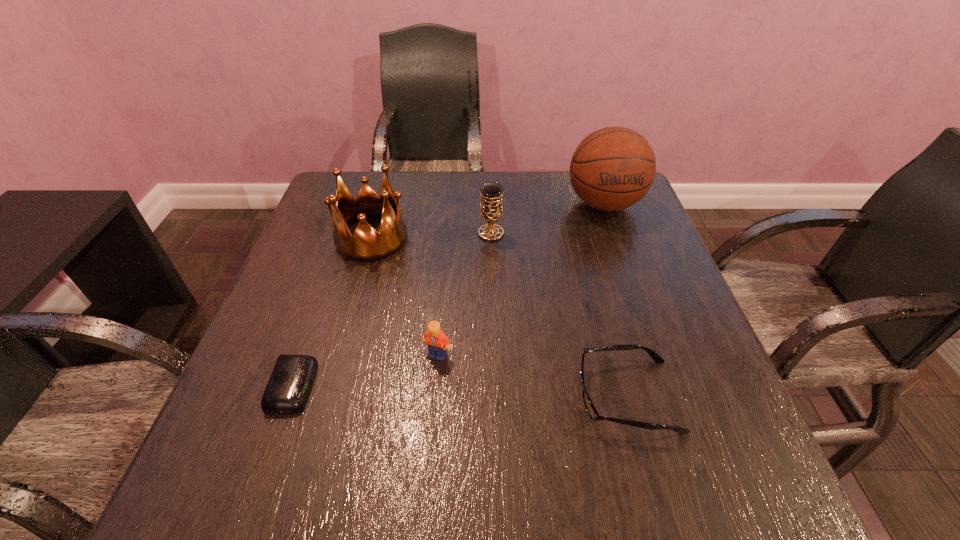
At what (x,y) coordinates should I click in order to perform the action: click on the tallest object. Please return your answer as a coordinate pair (x, y). The height and width of the screenshot is (540, 960). Looking at the image, I should click on (613, 168).

Find the location of `crown`. crown is located at coordinates (366, 245).

You are a GUI agent. You are given a task and a screenshot of the screen. Output one action in this format:
    pyautogui.click(x=<x>, y=<y>)
    Task: Click on the fourth shortest object
    Image resolution: width=960 pixels, height=540 pixels.
    Given the screenshot: What is the action you would take?
    pyautogui.click(x=491, y=211)

This screenshot has height=540, width=960. Identify the location of chalice. (491, 211).

Image resolution: width=960 pixels, height=540 pixels. Identify the location of the third shortest object. (436, 341).

Identify the location of Lego. (436, 341).

Identify the location of spectacles. This screenshot has width=960, height=540. (590, 408).

In order to click on the shortest object in this screenshot , I will do `click(288, 388)`.

Find the location of a particular element. free space located on the side with brand label of the tallest object is located at coordinates (647, 326).

In order to click on vacant area located 0.140m on the front of the second tallest object in this screenshot , I will do pyautogui.click(x=352, y=307).